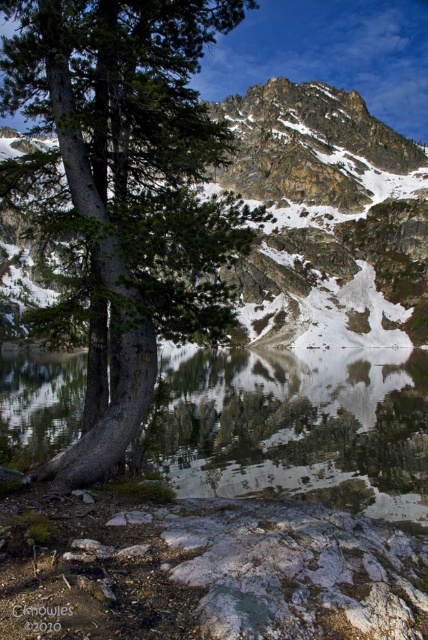
Consider the image. You are hiking and want to take a photo of the rocky gray mountain at upper center without the green matte tree at left blocking the view. Is there a way to position yourself so that the tree is not in the frame?

The green matte tree at left is below the rocky gray mountain at upper center, so if you move to a higher elevation or position yourself where the tree is out of sight, you can capture the mountain without obstruction.

You are standing at point (122,193) in the mountain landscape. What object is located exactly at your current position?

The green matte tree at left is located exactly at point (122,193).

You are an artist planning to sketch the scene. You need to decide which object to draw first so that it appears in front of the other. Based on their thickness, which object should you draw first, the green matte tree at left or the rocky gray mountain at upper center?

The green matte tree at left is thinner than the rocky gray mountain at upper center. Since the tree is thinner, it should be drawn first to appear in front of the mountain.